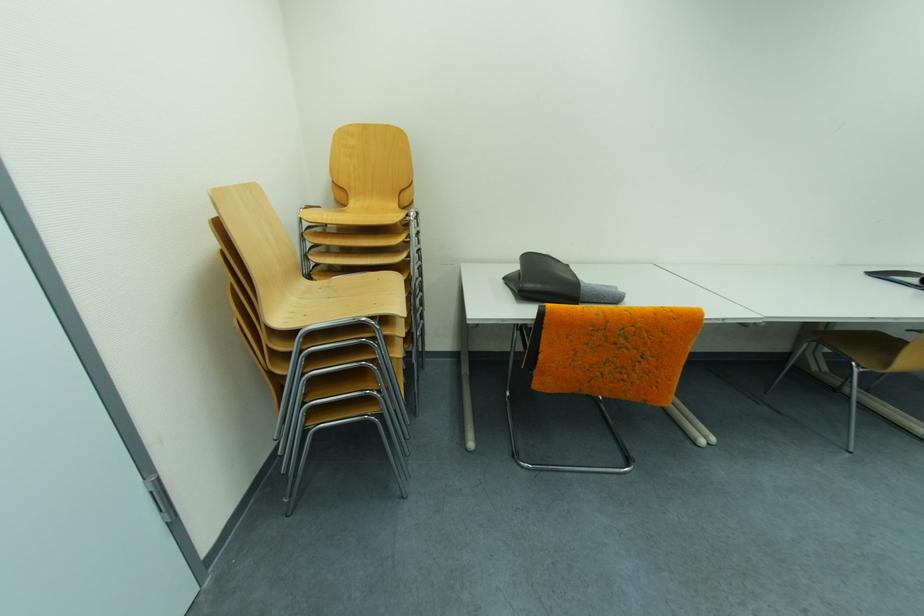
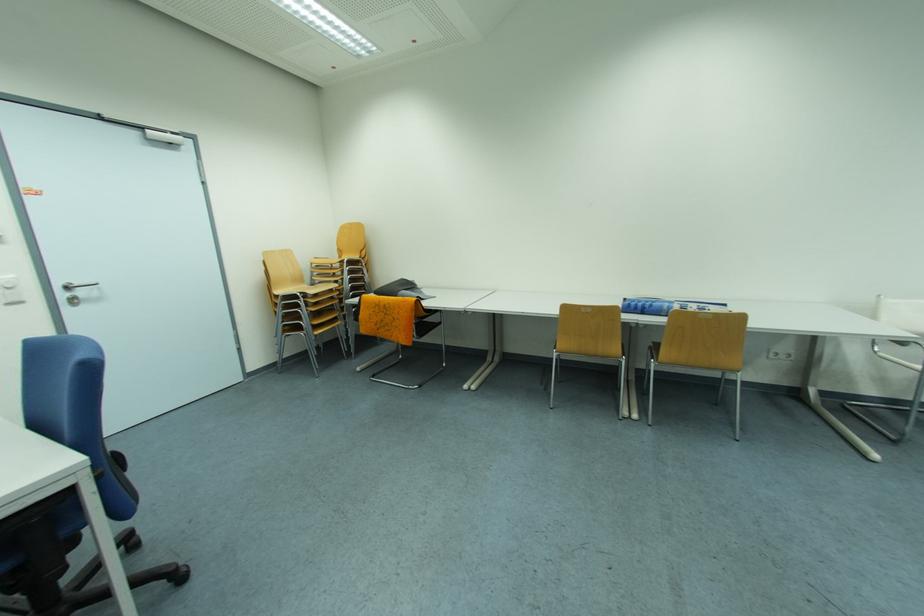
Locate, in the second image, the point that corresponds to (x=549, y=359) in the first image.

(369, 318)